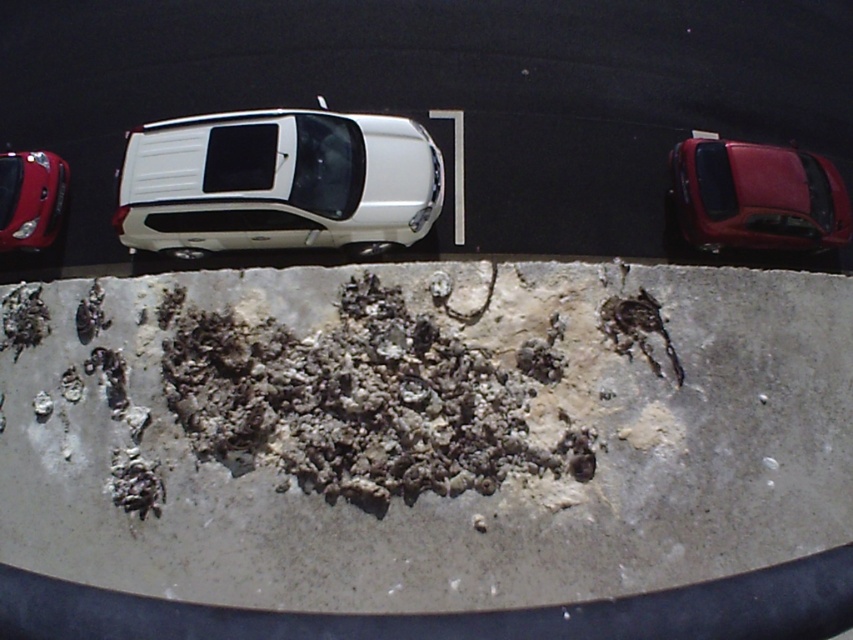
You are a delivery person needing to park your 2.5 meter wide delivery van between the glossy red car at right and the shiny red car at left. Can you fit your van between them?

The distance between the glossy red car at right and the shiny red car at left is 6.50 meters. Since your delivery van is only 2.5 meters wide, there is enough space to park between them.

You are standing at the point marked by point (277, 182) in the image. What object are you directly at?

You are directly at the white matte truck at center, as the point (277, 182) marks this object.

You are a delivery driver who needs to park your vehicle in a narrow space between two other cars. You see a white matte truck at center and a glossy red car at right in the parking lot. Which vehicle has a wider body to consider for parking?

The white matte truck at center has a wider body than the glossy red car at right, so you should consider its width when parking.